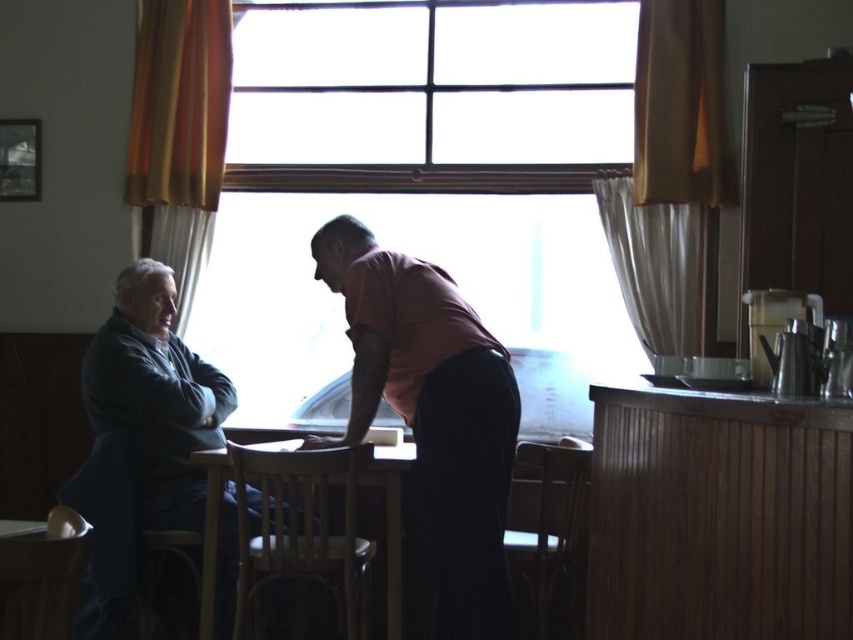
You are trying to decide whether to place a large painting on the wall behind the dark gray sweater at left or the wooden table at center. Based on their sizes, which object would require a larger space on the wall?

The dark gray sweater at left requires a larger space on the wall because its width is greater than that of the wooden table at center.

You are organizing a clothing donation drive and need to determine which item takes up more space in the donation box. Based on the scene, which object between the dark gray sweater at left and the matte pink shirt at center has a greater width?

The dark gray sweater at left has a greater width than the matte pink shirt at center.